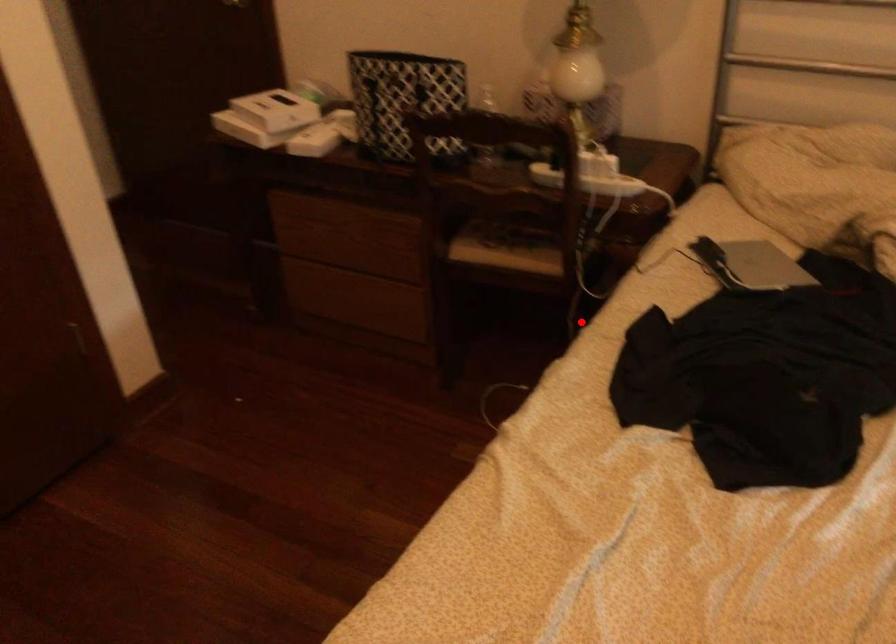
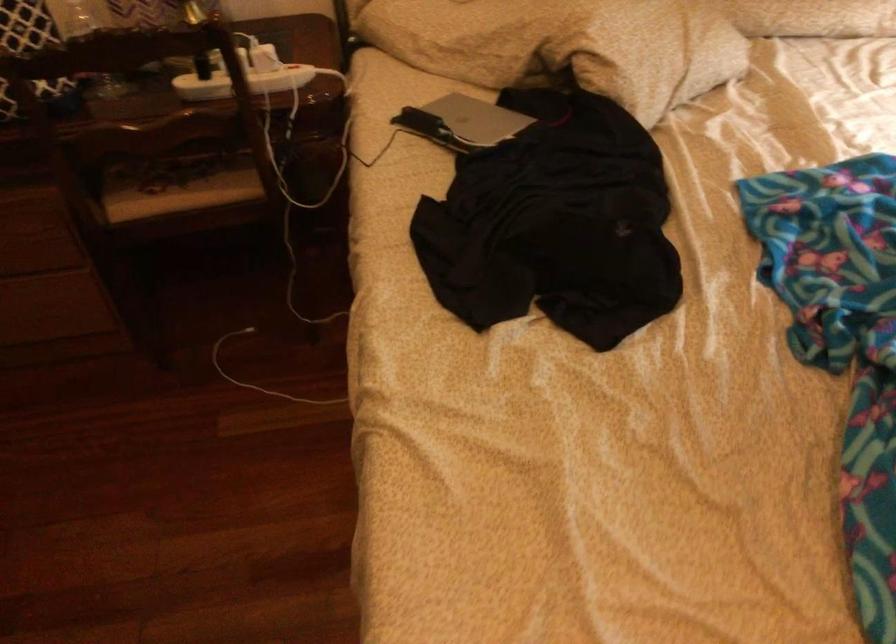
Question: I am providing you with two images of the same scene from different viewpoints. A red point is marked on the first image. Is the red point's position out of view in image 2?

Choices:
 (A) Yes
 (B) No

Answer: (B)